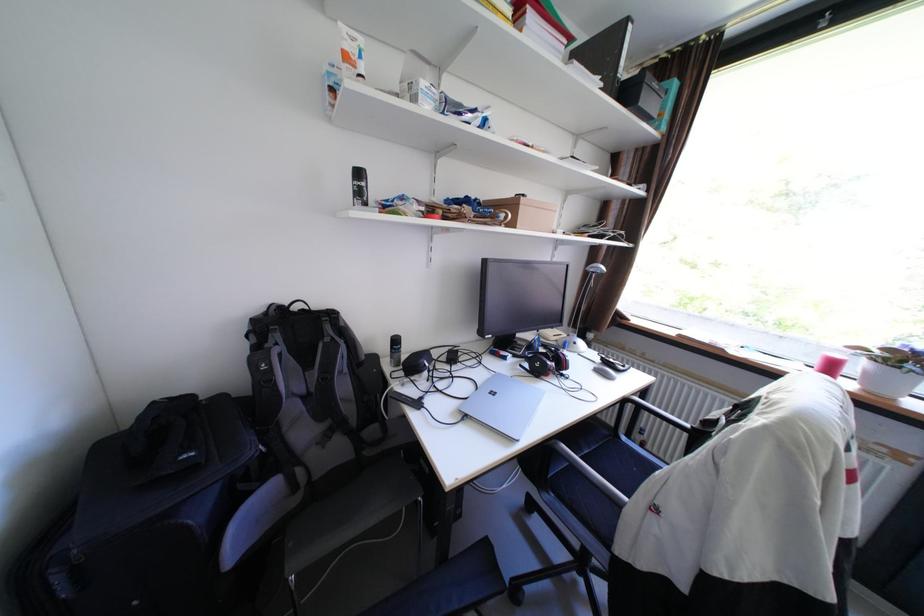
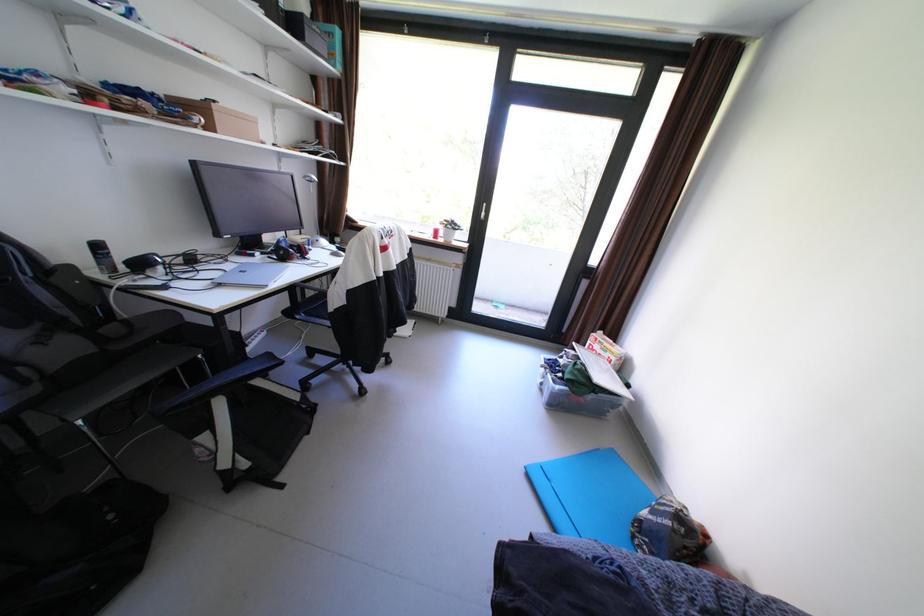
Find the pixel in the second image that matches (x=490, y=205) in the first image.

(172, 100)